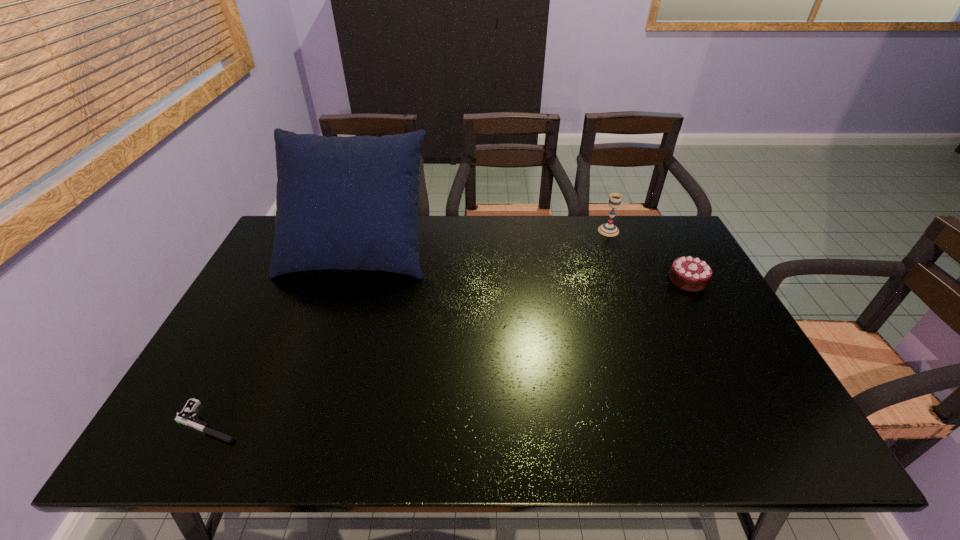
The height and width of the screenshot is (540, 960). Identify the location of free space at the right edge. (673, 292).

Identify the location of free point at the far right corner. (647, 232).

This screenshot has width=960, height=540. In order to click on free spot between the cushion and the shortest object in this screenshot , I will do `click(283, 335)`.

This screenshot has width=960, height=540. Identify the location of vacant area that lies between the chalice and the chocolate cake. (648, 255).

Locate an element on the screen. The width and height of the screenshot is (960, 540). vacant area between the cushion and the rightmost object is located at coordinates (522, 264).

At what (x,y) coordinates should I click in order to perform the action: click on free area in between the cushion and the nearest object. Please return your answer as a coordinate pair (x, y). Looking at the image, I should click on (283, 335).

Find the location of `unoccupied position between the tallest object and the chocolate cake`. unoccupied position between the tallest object and the chocolate cake is located at coordinates (522, 264).

Identify the location of empty location between the third object from left to right and the shortest object. Image resolution: width=960 pixels, height=540 pixels. (409, 326).

Where is `free spot between the tallest object and the rightmost object`? free spot between the tallest object and the rightmost object is located at coordinates (522, 264).

You are a GUI agent. You are given a task and a screenshot of the screen. Output one action in this format:
    pyautogui.click(x=<x>, y=<y>)
    Task: Click on the free area in between the tallest object and the nearest object
    The height and width of the screenshot is (540, 960).
    Given the screenshot: What is the action you would take?
    pyautogui.click(x=283, y=335)